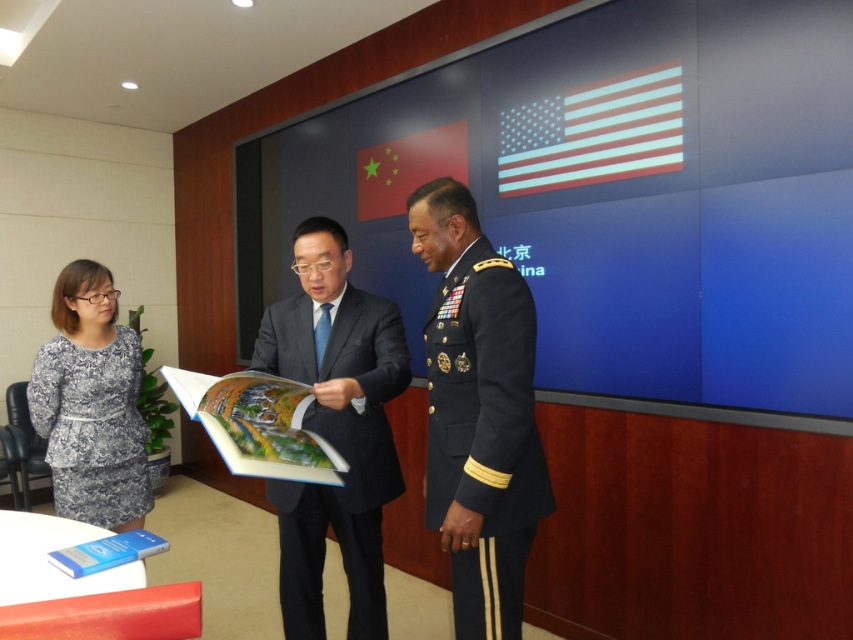
Question: From the image, what is the correct spatial relationship of dark blue military uniform at center in relation to printed fabric dress at left?

Choices:
 (A) above
 (B) below

Answer: (B)

Question: Can you confirm if dark blue fabric military uniform at right is positioned to the right of printed fabric dress at left?

Choices:
 (A) yes
 (B) no

Answer: (A)

Question: Which of these objects is positioned farthest from the dark blue military uniform at center?

Choices:
 (A) printed fabric dress at left
 (B) dark blue fabric military uniform at right

Answer: (A)

Question: Which point is farther to the camera?

Choices:
 (A) printed fabric dress at left
 (B) dark blue military uniform at center
 (C) dark blue fabric military uniform at right

Answer: (A)

Question: Is dark blue military uniform at center smaller than printed fabric dress at left?

Choices:
 (A) no
 (B) yes

Answer: (A)

Question: Among these objects, which one is farthest from the camera?

Choices:
 (A) printed fabric dress at left
 (B) dark blue military uniform at center

Answer: (A)